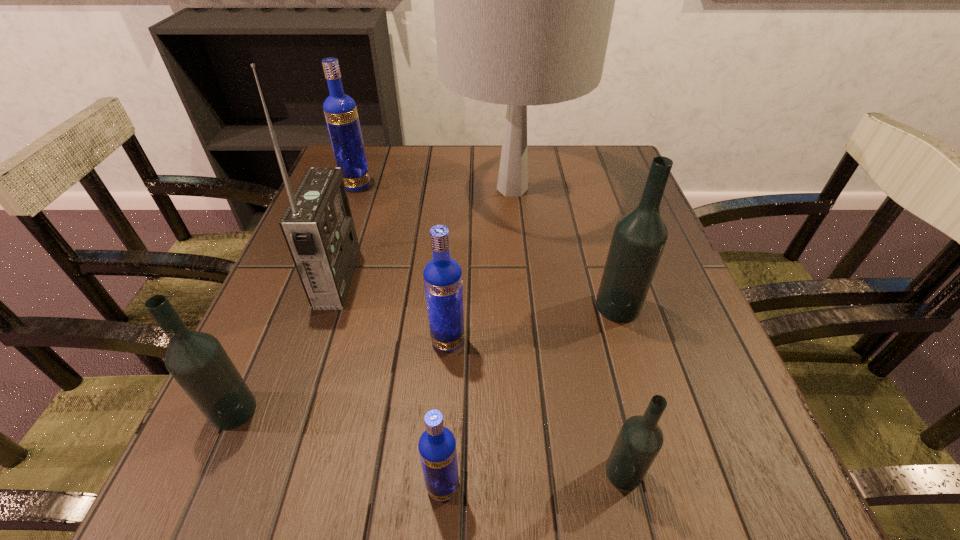
Identify the location of vacant area located 0.050m on the left of the smallest blue vodka. This screenshot has height=540, width=960. (389, 487).

This screenshot has width=960, height=540. I want to click on free space located on the right of the smallest black vodka, so click(x=708, y=472).

Locate an element on the screen. This screenshot has width=960, height=540. lampshade present at the far edge is located at coordinates (523, 0).

Where is `vodka present at the far edge`? This screenshot has height=540, width=960. vodka present at the far edge is located at coordinates (340, 110).

This screenshot has width=960, height=540. In order to click on radio receiver at the left edge in this screenshot , I will do coord(318,227).

At what (x,y) coordinates should I click in order to perform the action: click on lampshade that is at the right edge. Please return your answer as a coordinate pair (x, y). This screenshot has width=960, height=540. Looking at the image, I should click on (523, 0).

The width and height of the screenshot is (960, 540). I want to click on vodka present at the right edge, so click(x=639, y=237).

You are a GUI agent. You are given a task and a screenshot of the screen. Output one action in this format:
    pyautogui.click(x=<x>, y=<y>)
    Task: Click on the object that is positioned at the far left corner
    
    Given the screenshot: What is the action you would take?
    pyautogui.click(x=340, y=110)

This screenshot has width=960, height=540. Find the location of `object that is at the far right corner`. object that is at the far right corner is located at coordinates [523, 0].

In the image, there is a desktop. Identify the location of vacant space at the far edge. This screenshot has height=540, width=960. (437, 166).